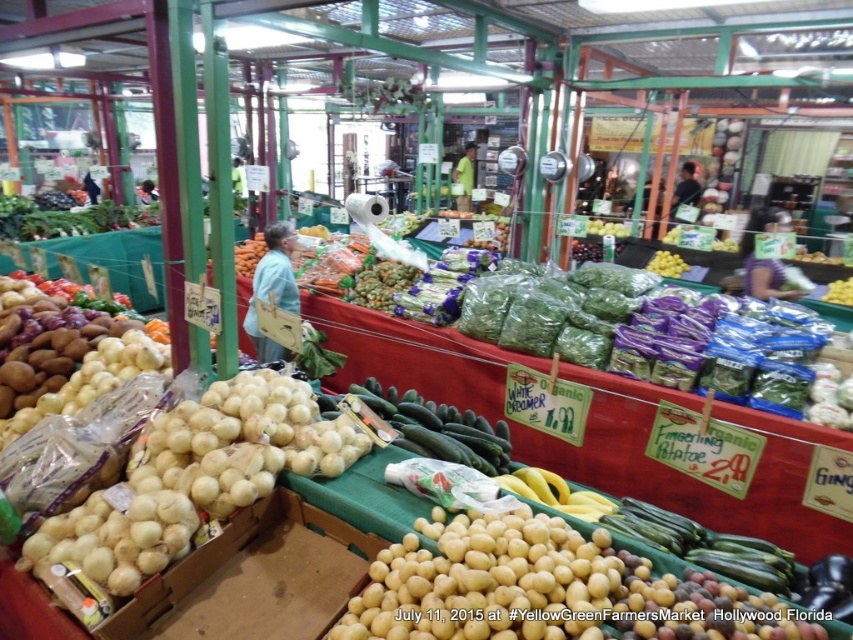
Can you confirm if green matte cucumber at center is positioned to the right of yellow matte/yellowish-green at center?

Incorrect, green matte cucumber at center is not on the right side of yellow matte/yellowish-green at center.

How much distance is there between green matte cucumber at center and yellow matte/yellowish-green at center?

3.70 meters

Who is more forward, [416,436] or [659,269]?

Point [416,436] is in front.

This screenshot has height=640, width=853. What are the coordinates of `green matte cucumber at center` in the screenshot? It's located at (438, 428).